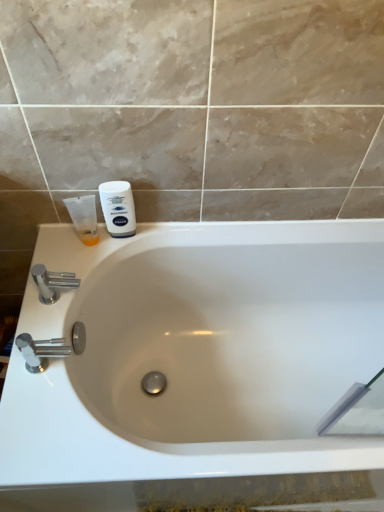
The image size is (384, 512). What do you see at coordinates (41, 351) in the screenshot? I see `polished chrome faucet at lower left, which appears as the first tap when viewed from the front` at bounding box center [41, 351].

The height and width of the screenshot is (512, 384). Describe the element at coordinates (52, 283) in the screenshot. I see `chrome metallic faucet at left, the second tap viewed from the front` at that location.

I want to click on polished chrome faucet at lower left, placed as the 2th tap when sorted from back to front, so click(41, 351).

From a real-world perspective, count 2nd shaving creams upward from the white glossy bathtub at center and point to it. Please provide its 2D coordinates.

[(118, 208)]

From a real-world perspective, between white matte shaving cream at upper left, the 2th shaving cream viewed from the left, and white glossy bathtub at center, who is vertically higher?

In real-world perspective, white matte shaving cream at upper left, the 2th shaving cream viewed from the left, is above.

Consider the image. Between white matte shaving cream at upper left, the 2th shaving cream viewed from the left, and white glossy bathtub at center, which one has smaller width?

white matte shaving cream at upper left, the 2th shaving cream viewed from the left.

Between chrome metallic faucet at left, arranged as the 1th tap when viewed from the back, and polished chrome faucet at lower left, acting as the 2th tap starting from the top, which one appears on the left side from the viewer's perspective?

Positioned to the left is chrome metallic faucet at left, arranged as the 1th tap when viewed from the back.

Is chrome metallic faucet at left, the 1th tap in the top-to-bottom sequence, wider or thinner than polished chrome faucet at lower left, marked as the first tap in a bottom-to-top arrangement?

chrome metallic faucet at left, the 1th tap in the top-to-bottom sequence, is wider than polished chrome faucet at lower left, marked as the first tap in a bottom-to-top arrangement.

In the scene shown: Which of these two, chrome metallic faucet at left, the second tap viewed from the front, or polished chrome faucet at lower left, which appears as the first tap when viewed from the front, is smaller?

With smaller size is chrome metallic faucet at left, the second tap viewed from the front.

Does point (70, 281) appear closer or farther from the camera than point (61, 352)?

Point (70, 281) is positioned farther from the camera compared to point (61, 352).

Is polished chrome faucet at lower left, which appears as the first tap when viewed from the front, bigger than translucent orange tube at left, which is the 2th shaving cream from right to left?

Yes, polished chrome faucet at lower left, which appears as the first tap when viewed from the front, is bigger than translucent orange tube at left, which is the 2th shaving cream from right to left.

Which object is further away from the camera taking this photo, polished chrome faucet at lower left, which appears as the first tap when viewed from the front, or translucent orange tube at left, which is the 2th shaving cream from right to left?

translucent orange tube at left, which is the 2th shaving cream from right to left, is further from the camera.

Is point (20, 346) in front of point (88, 245)?

That is True.

From a real-world perspective, which object rests below the other?

polished chrome faucet at lower left, marked as the first tap in a bottom-to-top arrangement, is physically lower.

Is chrome metallic faucet at left, the 1th tap in the top-to-bottom sequence, smaller than white glossy bathtub at center?

Correct, chrome metallic faucet at left, the 1th tap in the top-to-bottom sequence, occupies less space than white glossy bathtub at center.

Is chrome metallic faucet at left, the second tap viewed from the front, wider than white glossy bathtub at center?

No.

Considering the sizes of chrome metallic faucet at left, arranged as the 1th tap when viewed from the back, and white glossy bathtub at center in the image, is chrome metallic faucet at left, arranged as the 1th tap when viewed from the back, taller or shorter than white glossy bathtub at center?

Considering their sizes, chrome metallic faucet at left, arranged as the 1th tap when viewed from the back, has less height than white glossy bathtub at center.

From the picture: Which of these two, translucent orange tube at left, which appears as the 1th shaving cream when viewed from the left, or chrome metallic faucet at left, the second tap viewed from the front, stands shorter?

With less height is chrome metallic faucet at left, the second tap viewed from the front.

Is translucent orange tube at left, which appears as the 1th shaving cream when viewed from the left, further to camera compared to chrome metallic faucet at left, the second tap when ordered from bottom to top?

Yes, it is behind chrome metallic faucet at left, the second tap when ordered from bottom to top.

Is point (79, 206) more distant than point (37, 266)?

Yes, point (79, 206) is behind point (37, 266).

Is translucent orange tube at left, which is the 2th shaving cream from right to left, located outside chrome metallic faucet at left, the second tap when ordered from bottom to top?

Indeed, translucent orange tube at left, which is the 2th shaving cream from right to left, is completely outside chrome metallic faucet at left, the second tap when ordered from bottom to top.

Which of these two, white glossy bathtub at center or translucent orange tube at left, which is the 2th shaving cream from right to left, is thinner?

translucent orange tube at left, which is the 2th shaving cream from right to left.

Is white glossy bathtub at center taller than translucent orange tube at left, which is the 2th shaving cream from right to left?

Yes, white glossy bathtub at center is taller than translucent orange tube at left, which is the 2th shaving cream from right to left.

From the image's perspective, is white glossy bathtub at center below translucent orange tube at left, which appears as the 1th shaving cream when viewed from the left?

Yes.

Identify the location of bathtub below the translucent orange tube at left, which appears as the 1th shaving cream when viewed from the left (from a real-world perspective). (198, 352).

From their relative heights in the image, would you say translucent orange tube at left, which is the 2th shaving cream from right to left, is taller or shorter than white matte shaving cream at upper left, arranged as the first shaving cream when viewed from the right?

Considering their sizes, translucent orange tube at left, which is the 2th shaving cream from right to left, has less height than white matte shaving cream at upper left, arranged as the first shaving cream when viewed from the right.

Measure the distance between translucent orange tube at left, which is the 2th shaving cream from right to left, and white matte shaving cream at upper left, arranged as the first shaving cream when viewed from the right.

translucent orange tube at left, which is the 2th shaving cream from right to left, is 3.00 inches away from white matte shaving cream at upper left, arranged as the first shaving cream when viewed from the right.

What's the angular difference between translucent orange tube at left, which is the 2th shaving cream from right to left, and white matte shaving cream at upper left, arranged as the first shaving cream when viewed from the right,'s facing directions?

translucent orange tube at left, which is the 2th shaving cream from right to left, and white matte shaving cream at upper left, arranged as the first shaving cream when viewed from the right, are facing 0.00504 degrees away from each other.

Are translucent orange tube at left, which appears as the 1th shaving cream when viewed from the left, and white matte shaving cream at upper left, the 2th shaving cream viewed from the left, far apart?

translucent orange tube at left, which appears as the 1th shaving cream when viewed from the left, is near white matte shaving cream at upper left, the 2th shaving cream viewed from the left, not far away.

At what (x,y) coordinates should I click in order to perform the action: click on bathtub on the right of white matte shaving cream at upper left, arranged as the first shaving cream when viewed from the right. Please return your answer as a coordinate pair (x, y). Image resolution: width=384 pixels, height=512 pixels. Looking at the image, I should click on (198, 352).

In the image, there is a polished chrome faucet at lower left, marked as the first tap in a bottom-to-top arrangement. Where is `tap above it (from the image's perspective)`? The height and width of the screenshot is (512, 384). tap above it (from the image's perspective) is located at coordinates click(52, 283).

Estimate the real-world distances between objects in this image. Which object is further from polished chrome faucet at lower left, marked as the first tap in a bottom-to-top arrangement, white matte shaving cream at upper left, arranged as the first shaving cream when viewed from the right, or white glossy bathtub at center?

Based on the image, white glossy bathtub at center appears to be further to polished chrome faucet at lower left, marked as the first tap in a bottom-to-top arrangement.

When comparing their distances from polished chrome faucet at lower left, which appears as the first tap when viewed from the front, does white matte shaving cream at upper left, the 2th shaving cream viewed from the left, or translucent orange tube at left, which appears as the 1th shaving cream when viewed from the left, seem further?

Among the two, white matte shaving cream at upper left, the 2th shaving cream viewed from the left, is located further to polished chrome faucet at lower left, which appears as the first tap when viewed from the front.

Looking at the image, which one is located further to chrome metallic faucet at left, the 1th tap in the top-to-bottom sequence, polished chrome faucet at lower left, placed as the 2th tap when sorted from back to front, or white matte shaving cream at upper left, the 2th shaving cream viewed from the left?

white matte shaving cream at upper left, the 2th shaving cream viewed from the left, is further to chrome metallic faucet at left, the 1th tap in the top-to-bottom sequence.

From the image, which object appears to be farther from chrome metallic faucet at left, the 1th tap in the top-to-bottom sequence, white glossy bathtub at center or translucent orange tube at left, which is the 2th shaving cream from right to left?

Among the two, white glossy bathtub at center is located further to chrome metallic faucet at left, the 1th tap in the top-to-bottom sequence.

In the scene shown: Based on their spatial positions, is white glossy bathtub at center or white matte shaving cream at upper left, arranged as the first shaving cream when viewed from the right, closer to translucent orange tube at left, which appears as the 1th shaving cream when viewed from the left?

Based on the image, white matte shaving cream at upper left, arranged as the first shaving cream when viewed from the right, appears to be nearer to translucent orange tube at left, which appears as the 1th shaving cream when viewed from the left.

Which object lies further to the anchor point white matte shaving cream at upper left, the 2th shaving cream viewed from the left, polished chrome faucet at lower left, acting as the 2th tap starting from the top, or translucent orange tube at left, which is the 2th shaving cream from right to left?

polished chrome faucet at lower left, acting as the 2th tap starting from the top, is positioned further to the anchor white matte shaving cream at upper left, the 2th shaving cream viewed from the left.

Which object lies nearer to the anchor point white glossy bathtub at center, chrome metallic faucet at left, the 1th tap in the top-to-bottom sequence, or polished chrome faucet at lower left, marked as the first tap in a bottom-to-top arrangement?

The object closer to white glossy bathtub at center is chrome metallic faucet at left, the 1th tap in the top-to-bottom sequence.

Estimate the real-world distances between objects in this image. Which object is closer to white glossy bathtub at center, polished chrome faucet at lower left, which appears as the first tap when viewed from the front, or white matte shaving cream at upper left, the 2th shaving cream viewed from the left?

The object closer to white glossy bathtub at center is white matte shaving cream at upper left, the 2th shaving cream viewed from the left.

Where is `tap between translucent orange tube at left, which appears as the 1th shaving cream when viewed from the left, and polished chrome faucet at lower left, marked as the first tap in a bottom-to-top arrangement, vertically`? The width and height of the screenshot is (384, 512). tap between translucent orange tube at left, which appears as the 1th shaving cream when viewed from the left, and polished chrome faucet at lower left, marked as the first tap in a bottom-to-top arrangement, vertically is located at coordinates (52, 283).

Locate an element on the screen. tap that lies between white matte shaving cream at upper left, arranged as the first shaving cream when viewed from the right, and polished chrome faucet at lower left, placed as the 2th tap when sorted from back to front, from top to bottom is located at coordinates (52, 283).

Locate an element on the screen. This screenshot has width=384, height=512. tap located between chrome metallic faucet at left, the 1th tap in the top-to-bottom sequence, and white glossy bathtub at center in the left-right direction is located at coordinates (41, 351).

At what (x,y) coordinates should I click in order to perform the action: click on shaving cream between white matte shaving cream at upper left, the 2th shaving cream viewed from the left, and chrome metallic faucet at left, the second tap when ordered from bottom to top, in the vertical direction. Please return your answer as a coordinate pair (x, y). Image resolution: width=384 pixels, height=512 pixels. Looking at the image, I should click on (84, 218).